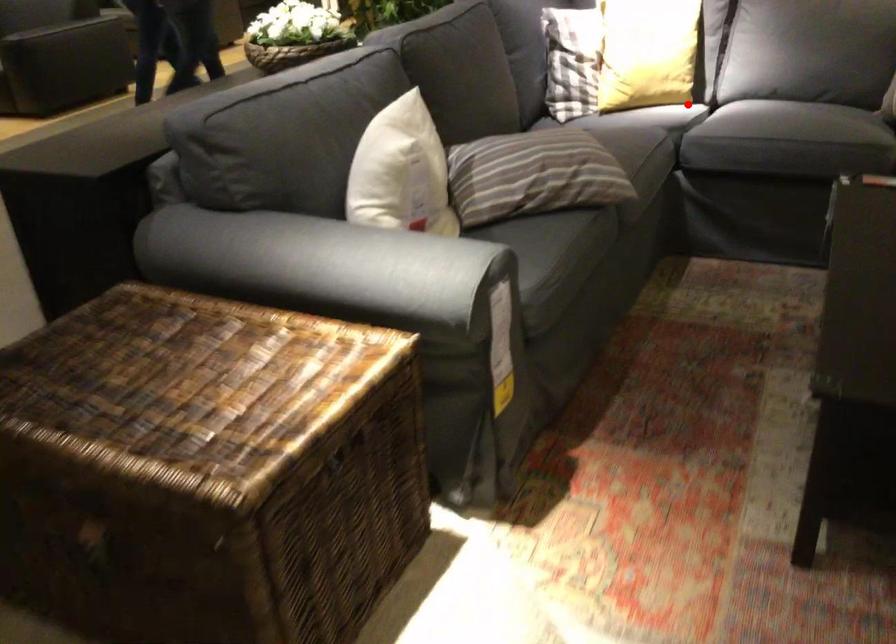
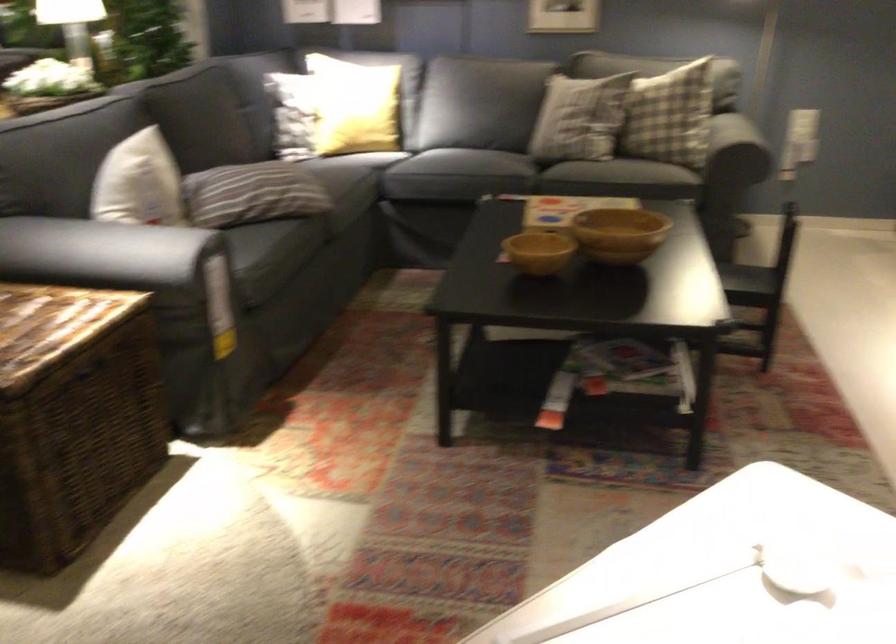
Question: I am providing you with two images of the same scene from different viewpoints. A red point is shown in image1. For the corresponding object point in image2, is it positioned nearer or farther from the camera?

Choices:
 (A) Nearer
 (B) Farther

Answer: (B)